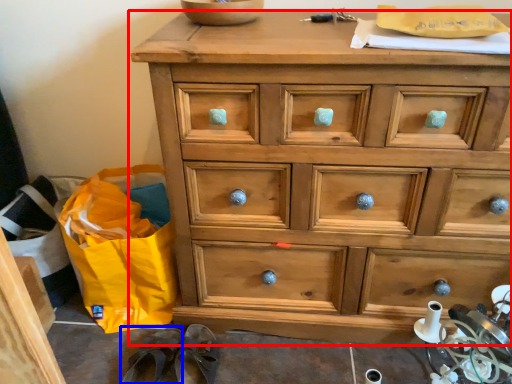
Question: Which point is closer to the camera, chest of drawers (highlighted by a red box) or slipper (highlighted by a blue box)?

Choices:
 (A) chest of drawers
 (B) slipper

Answer: (A)